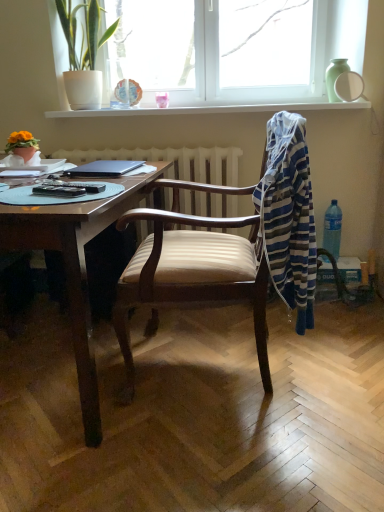
What are the coordinates of `vacant space to the right of wooden chair at center` in the screenshot? It's located at (x=334, y=370).